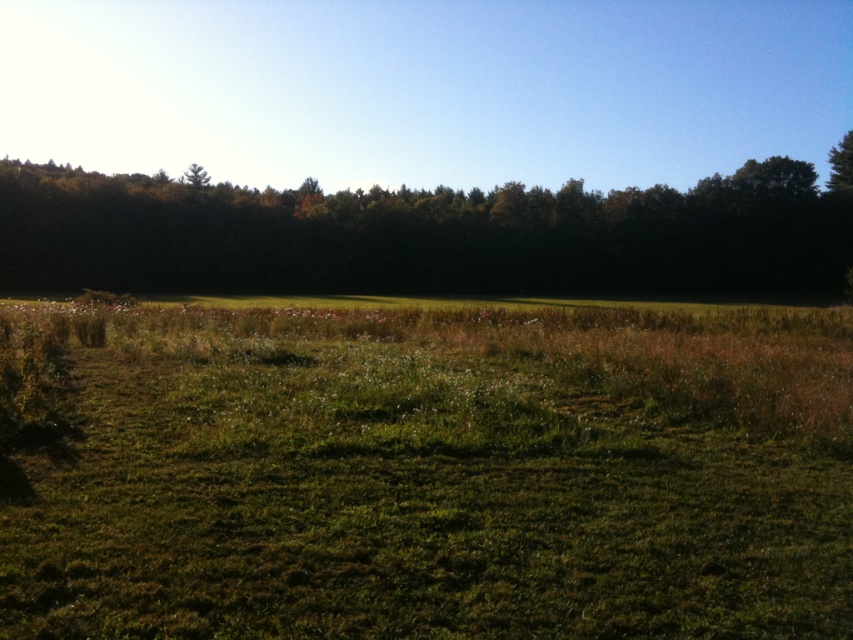
Is the position of green grassy field at center more distant than that of green leafy tree at upper center?

That is False.

Can you confirm if green grassy field at center is taller than green leafy tree at upper center?

In fact, green grassy field at center may be shorter than green leafy tree at upper center.

Between point (498, 472) and point (799, 195), which one is positioned behind?

Positioned behind is point (799, 195).

The height and width of the screenshot is (640, 853). Identify the location of green grassy field at center. (427, 472).